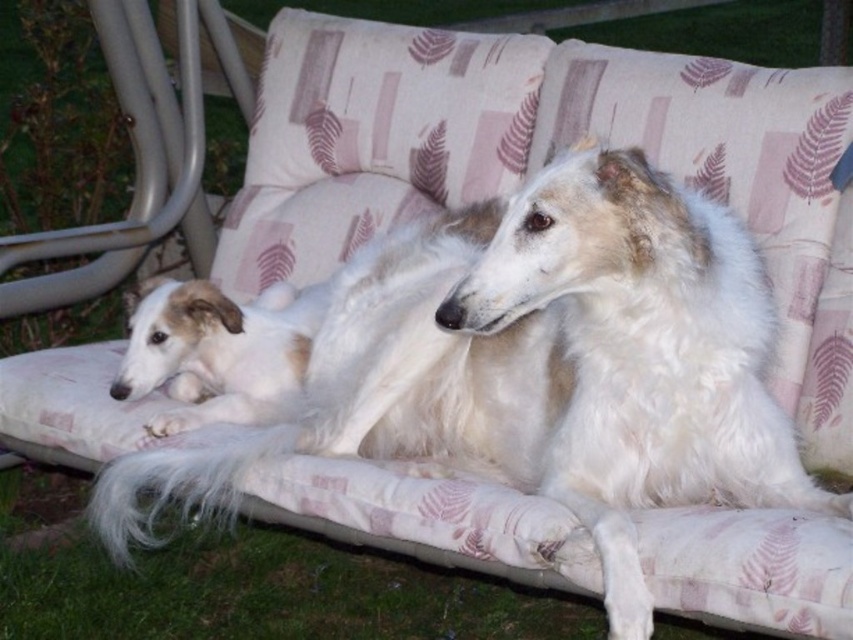
Is white fluffy dog at center to the right of light brown fur at center from the viewer's perspective?

Yes, white fluffy dog at center is to the right of light brown fur at center.

From the picture: Between white fluffy dog at center and light brown fur at center, which one is positioned higher?

light brown fur at center

From the picture: Who is more forward, [378,433] or [148,308]?

Point [378,433] is in front.

The width and height of the screenshot is (853, 640). In order to click on white fluffy dog at center in this screenshot , I will do `click(537, 365)`.